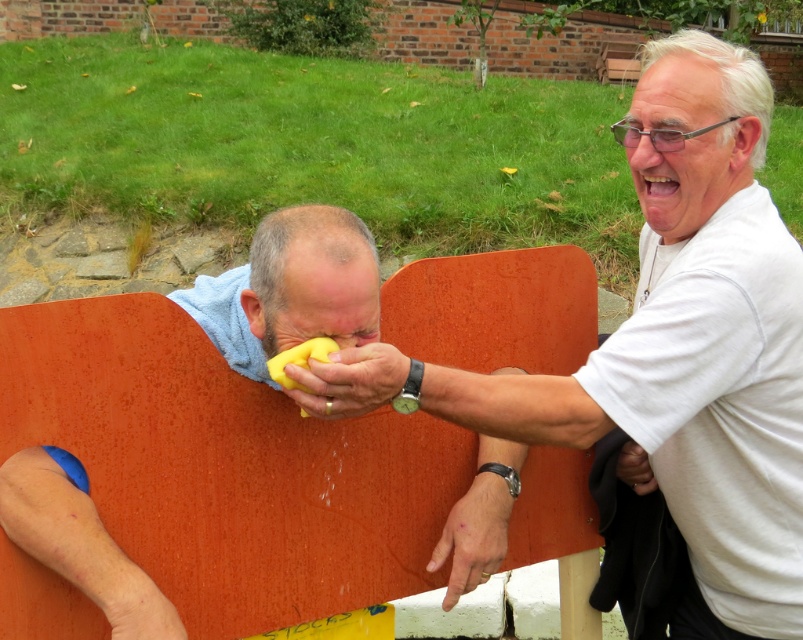
Can you confirm if orange painted wood park bench at center is thinner than yellow rubber sponge at center?

No, orange painted wood park bench at center is not thinner than yellow rubber sponge at center.

Does orange painted wood park bench at center have a smaller size compared to yellow rubber sponge at center?

Actually, orange painted wood park bench at center might be larger than yellow rubber sponge at center.

What do you see at coordinates (227, 467) in the screenshot? I see `orange painted wood park bench at center` at bounding box center [227, 467].

This screenshot has height=640, width=803. Identify the location of orange painted wood park bench at center. (227, 467).

Who is positioned more to the right, orange painted wood park bench at center or yellow rubber duck at center?

yellow rubber duck at center

Does orange painted wood park bench at center have a smaller size compared to yellow rubber duck at center?

Indeed, orange painted wood park bench at center has a smaller size compared to yellow rubber duck at center.

Is point (215, 444) positioned behind point (646, 120)?

That is False.

At what (x,y) coordinates should I click in order to perform the action: click on orange painted wood park bench at center. Please return your answer as a coordinate pair (x, y). Looking at the image, I should click on (227, 467).

Is yellow rubber duck at center bigger than yellow rubber sponge at center?

Indeed, yellow rubber duck at center has a larger size compared to yellow rubber sponge at center.

Between point (773, 636) and point (304, 360), which one is positioned in front?

Point (304, 360) is in front.

You are a GUI agent. You are given a task and a screenshot of the screen. Output one action in this format:
    pyautogui.click(x=<x>, y=<y>)
    Task: Click on the yellow rubber duck at center
    
    Given the screenshot: What is the action you would take?
    pyautogui.click(x=669, y=348)